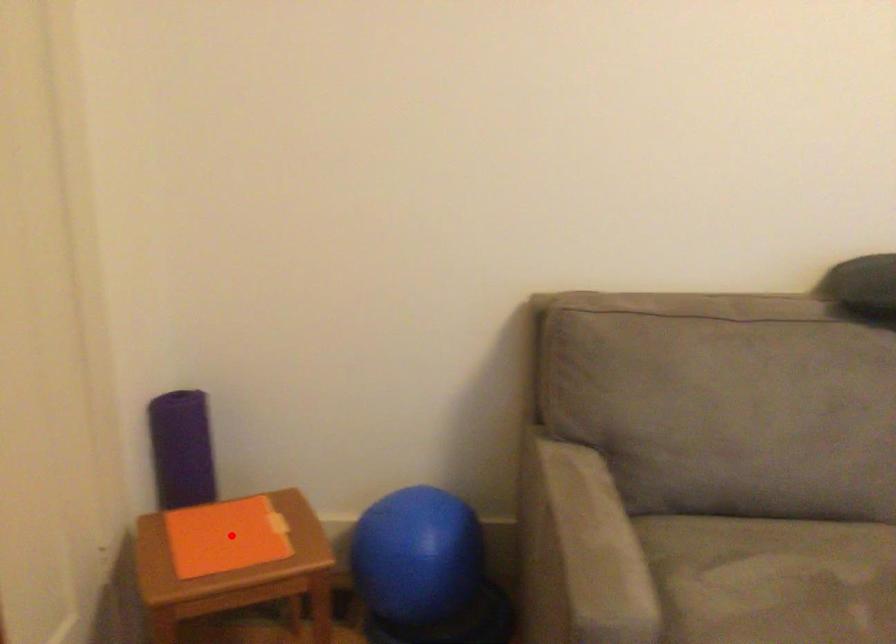
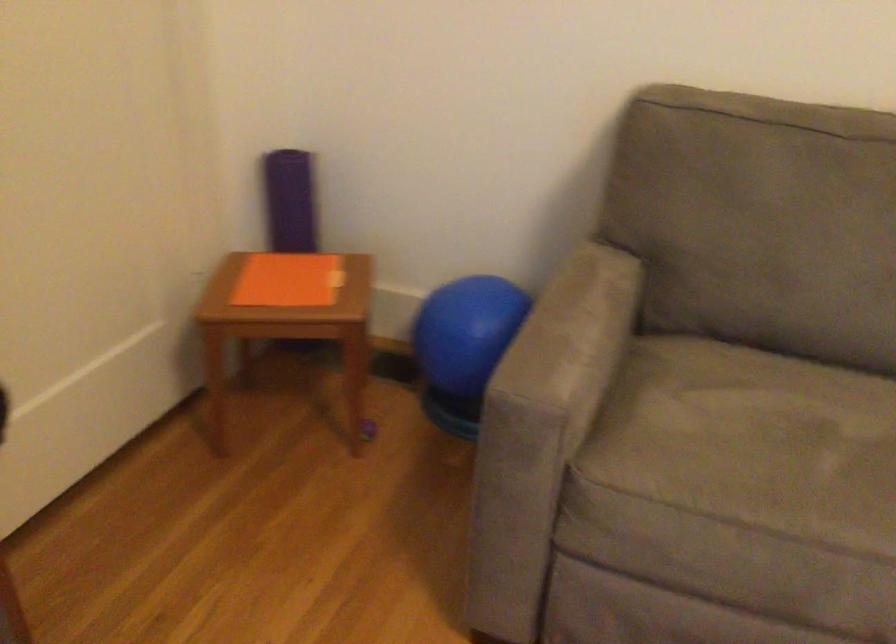
Locate, in the second image, the point that corresponds to the highlighted location in the first image.

(288, 279)